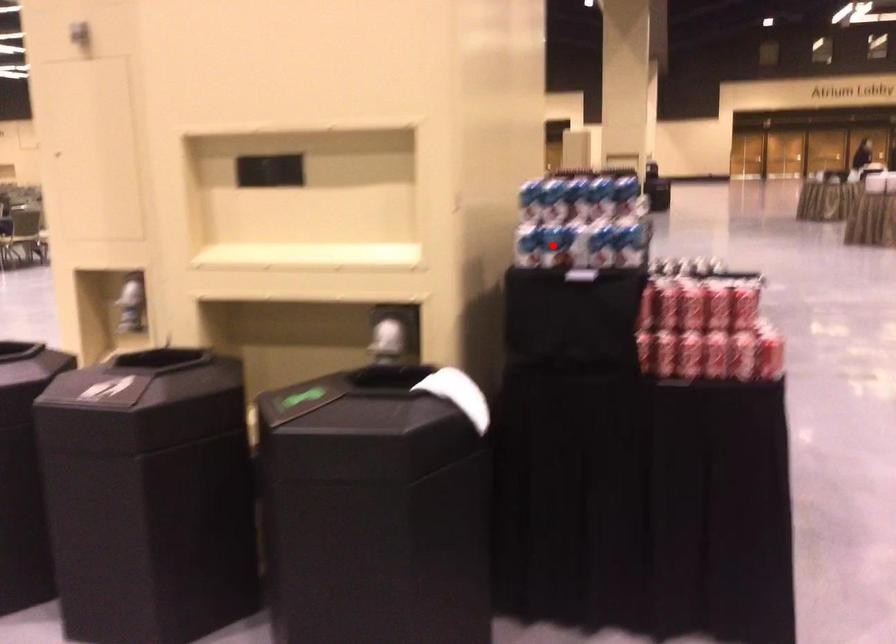
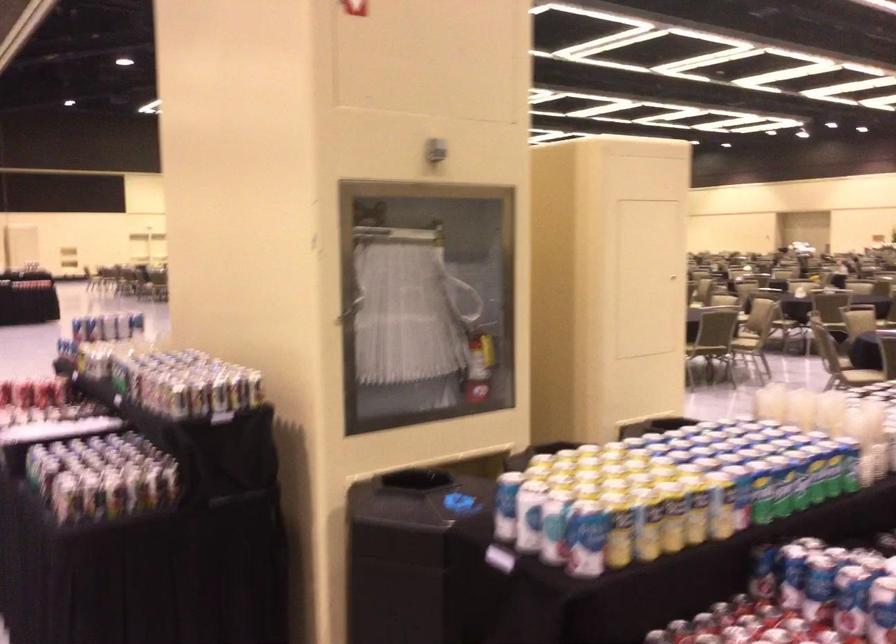
Question: I am providing you with two images of the same scene from different viewpoints. A red point is marked on the first image. Can you still see the location of the red point in image 2?

Choices:
 (A) Yes
 (B) No

Answer: (B)